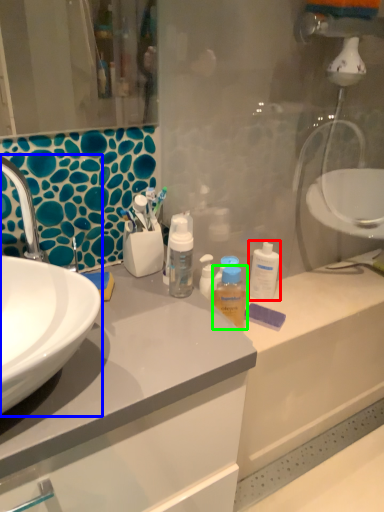
Question: Which is nearer to the cleaning product (highlighted by a red box)? sink (highlighted by a blue box) or mouthwash (highlighted by a green box).

Choices:
 (A) sink
 (B) mouthwash

Answer: (B)